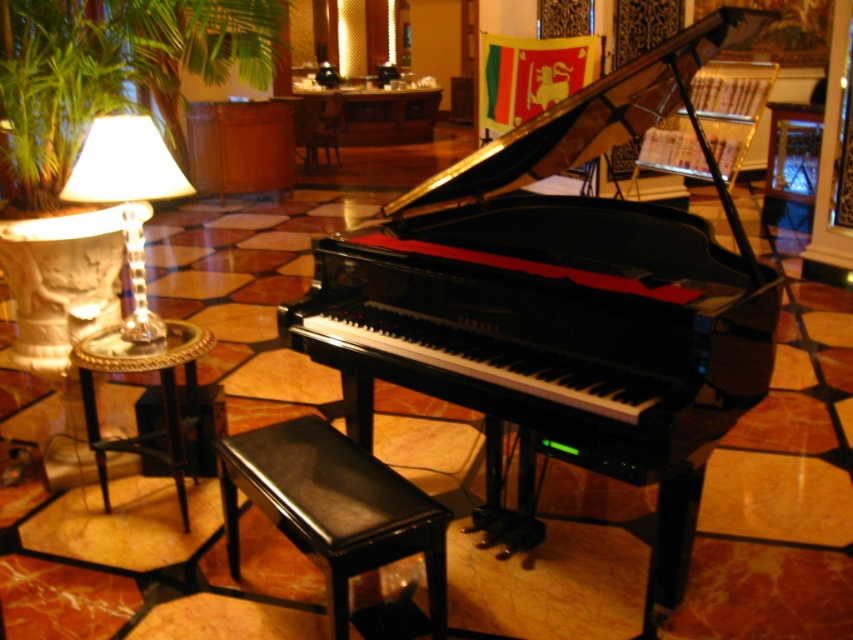
Question: Can you confirm if black polished piano at center is smaller than green leafy plant at left?

Choices:
 (A) yes
 (B) no

Answer: (A)

Question: Does metallic gold side table at left have a lesser width compared to wooden chair at center?

Choices:
 (A) yes
 (B) no

Answer: (B)

Question: Can you confirm if black leather music stool at lower center is positioned below metallic gold side table at left?

Choices:
 (A) yes
 (B) no

Answer: (A)

Question: Which point appears closest to the camera in this image?

Choices:
 (A) (390, 556)
 (B) (323, 122)

Answer: (A)

Question: Among these objects, which one is farthest from the camera?

Choices:
 (A) translucent glass lampshade at left
 (B) black polished piano at center
 (C) black leather music stool at lower center

Answer: (A)

Question: Which of the following is the farthest from the observer?

Choices:
 (A) black polished piano at center
 (B) green leafy plant at left
 (C) metallic gold side table at left
 (D) translucent glass lampshade at left

Answer: (B)